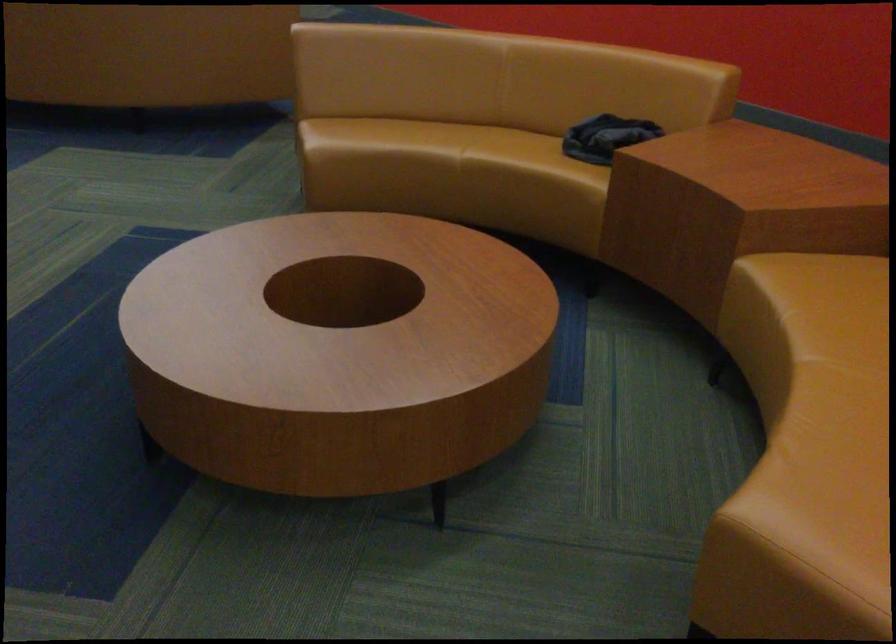
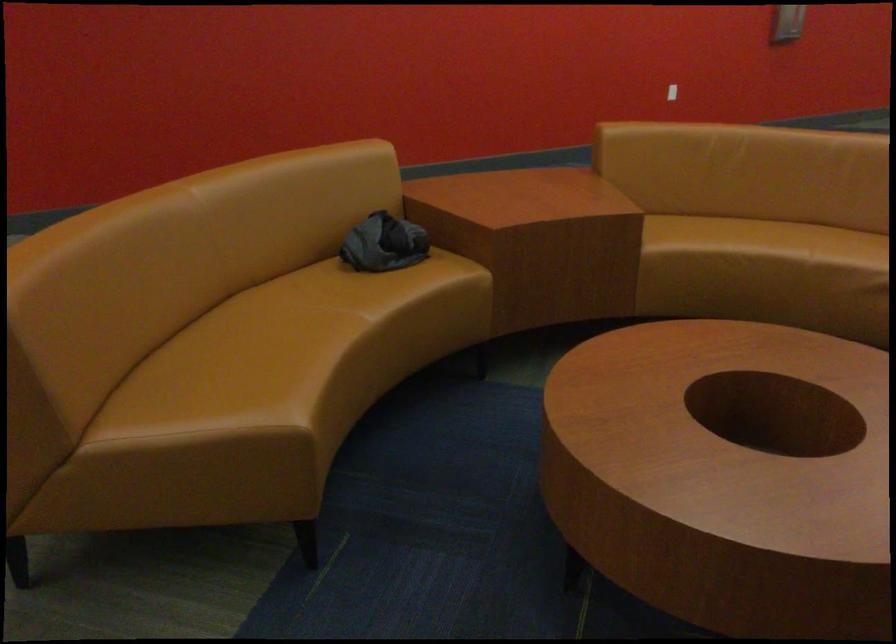
The point at [806,298] is marked in the first image. Where is the corresponding point in the second image?

(719, 242)